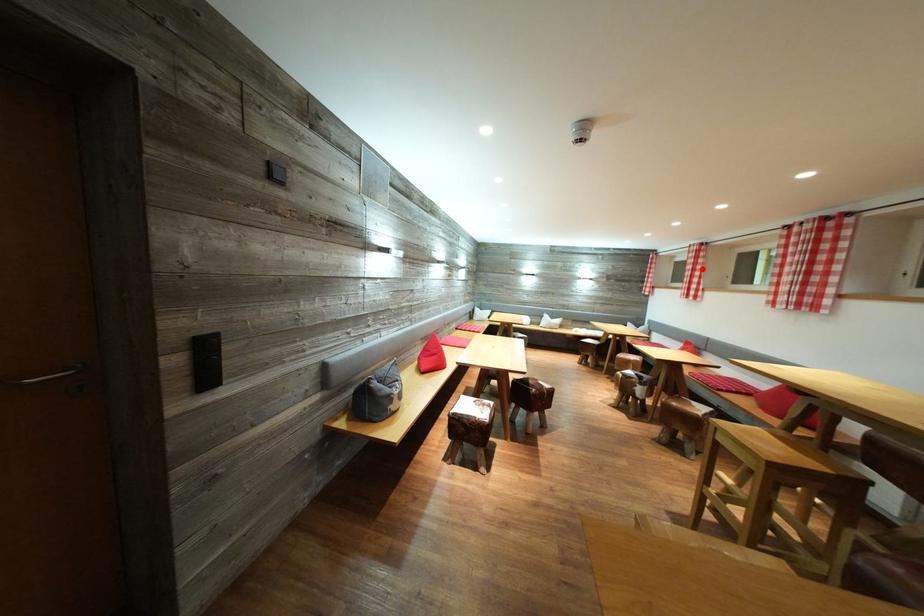
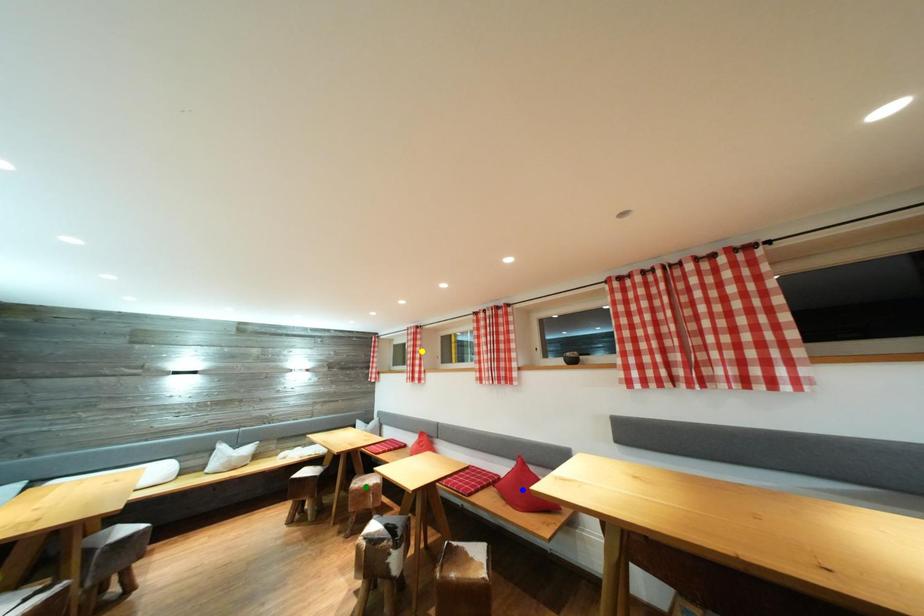
Question: I am providing you with two images of the same scene from different viewpoints. A red point is marked on the first image. You are given multiple points on the second image. Can you choose the point in image 2 that corresponds to the point in image 1?

Choices:
 (A) yellow point
 (B) blue point
 (C) green point

Answer: (A)